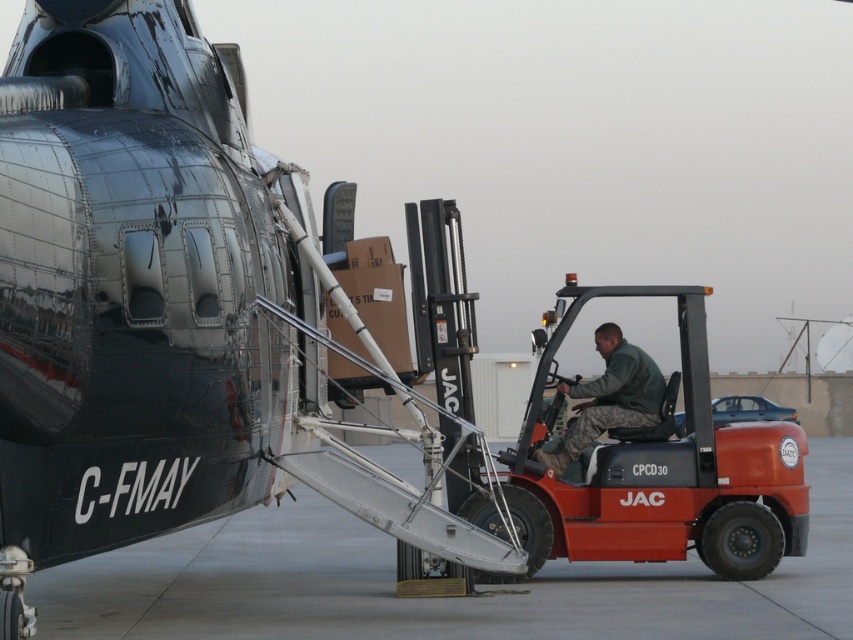
You are a photographer standing at the edge of the airfield. You want to take a photo of the shiny metallic airplane at center and the camouflage fabric uniform at right. Which object should you focus on first if you want both to be in sharp focus?

The shiny metallic airplane at center is closer to the viewer than the camouflage fabric uniform at right. To have both in sharp focus, focus on the camouflage fabric uniform at right since it is farther away, as depth of field extends behind the point of focus.

You are a pilot standing on the metallic gray tarmac at lower center and need to reach the camouflage fabric uniform at right. Is the path clear for you to walk directly to them without obstacles?

The metallic gray tarmac at lower center is in front of camouflage fabric uniform at right, so the path is clear for you to walk directly to them without obstacles.